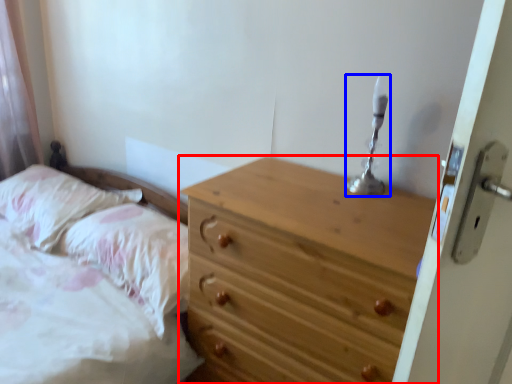
Question: Which object is closer to the camera taking this photo, chest of drawers (highlighted by a red box) or candle holder (highlighted by a blue box)?

Choices:
 (A) chest of drawers
 (B) candle holder

Answer: (A)